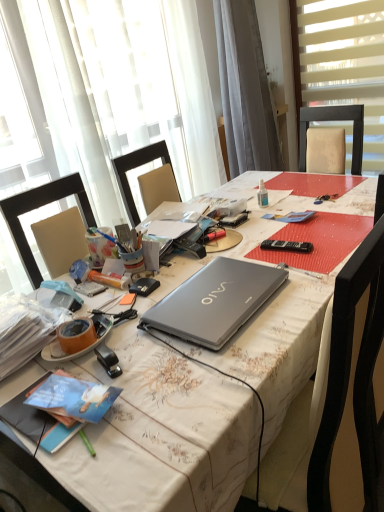
You are a GUI agent. You are given a task and a screenshot of the screen. Output one action in this format:
    pyautogui.click(x=<x>, y=<y>)
    Task: Click on the unoccupied area behind black plastic remote control at center
    
    Given the screenshot: What is the action you would take?
    pyautogui.click(x=274, y=231)